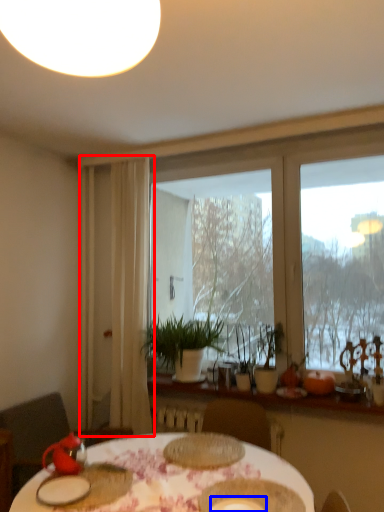
Question: Which object appears closest to the camera in this image, curtain (highlighted by a red box) or tableware (highlighted by a blue box)?

Choices:
 (A) curtain
 (B) tableware

Answer: (B)